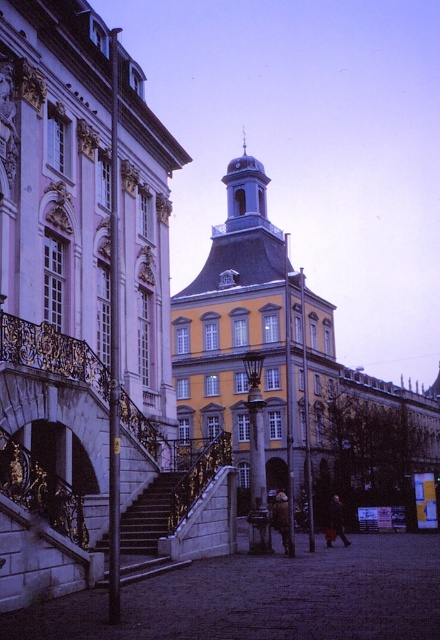
Does dark gray stone stairs at center appear on the right side of dark brown leather coat at center?

No, dark gray stone stairs at center is not to the right of dark brown leather coat at center.

Is point (128, 532) closer to viewer compared to point (337, 508)?

Yes, it is in front of point (337, 508).

The image size is (440, 640). Find the location of `dark gray stone stairs at center`. dark gray stone stairs at center is located at coordinates (147, 516).

Is the position of yellow matte building at center less distant than that of camouflage jacket at center?

No, it is not.

Between point (286, 241) and point (282, 525), which one is positioned in front?

Point (282, 525) is in front.

Does point (314, 392) lie in front of point (286, 516)?

No, (314, 392) is behind (286, 516).

This screenshot has height=640, width=440. I want to click on yellow matte building at center, so click(293, 371).

Is point (289, 552) less distant than point (338, 513)?

Yes, point (289, 552) is in front of point (338, 513).

I want to click on camouflage jacket at center, so click(282, 522).

What are the coordinates of `camouflage jacket at center` in the screenshot? It's located at (282, 522).